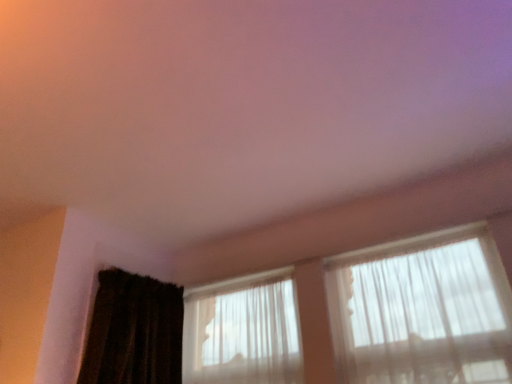
Question: Is dark brown textured curtain at lower left inside or outside of translucent fabric at upper right, positioned as the 1th window in right-to-left order?

Choices:
 (A) inside
 (B) outside

Answer: (B)

Question: In the image, is dark brown textured curtain at lower left positioned in front of or behind translucent fabric at upper right, which ranks as the second window in left-to-right order?

Choices:
 (A) front
 (B) behind

Answer: (B)

Question: Which object is positioned closest to the translucent fabric at upper right, positioned as the 1th window in right-to-left order?

Choices:
 (A) translucent fabric window at center, which is the first window from left to right
 (B) dark brown textured curtain at lower left

Answer: (A)

Question: Based on their relative distances, which object is farther from the translucent fabric window at center, the second window positioned from the right?

Choices:
 (A) translucent fabric at upper right, which ranks as the second window in left-to-right order
 (B) dark brown textured curtain at lower left

Answer: (A)